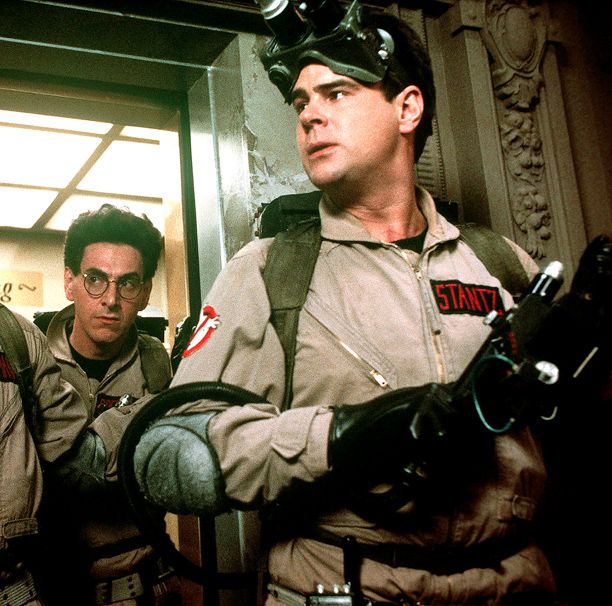
Image resolution: width=612 pixels, height=606 pixels. I want to click on light, so 49,159.